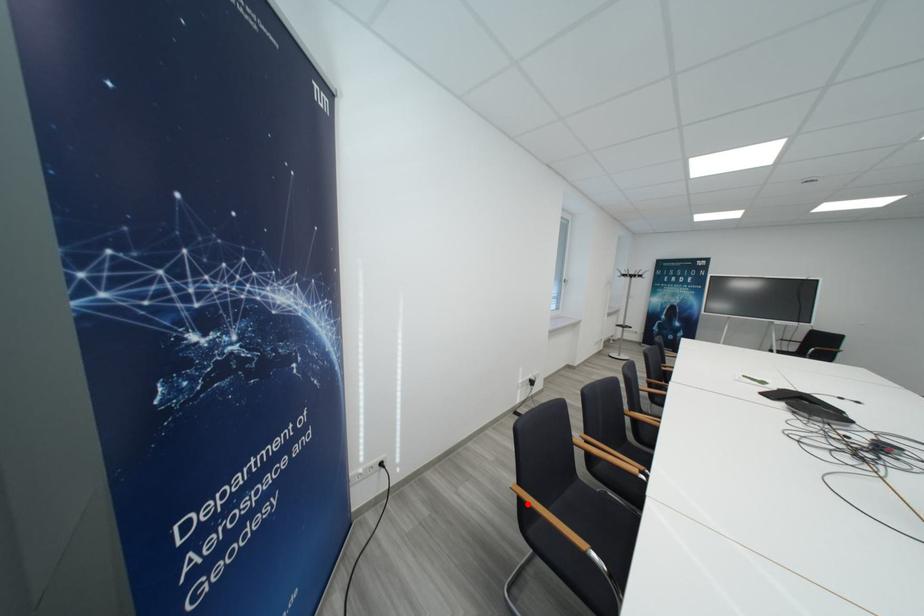
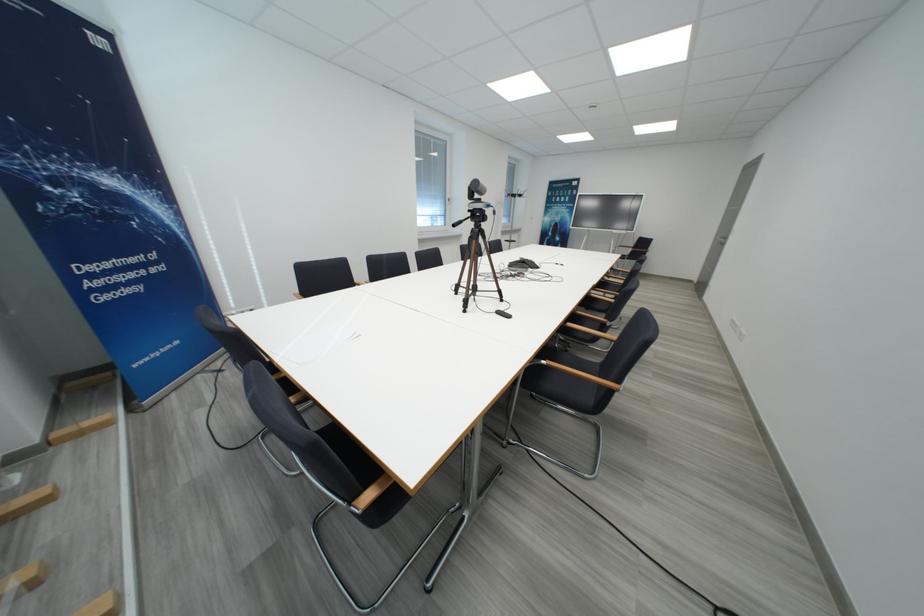
Question: I am providing you with two images of the same scene from different viewpoints. A red point is marked on the first image. Can you still see the location of the red point in image 2?

Choices:
 (A) Yes
 (B) No

Answer: (B)